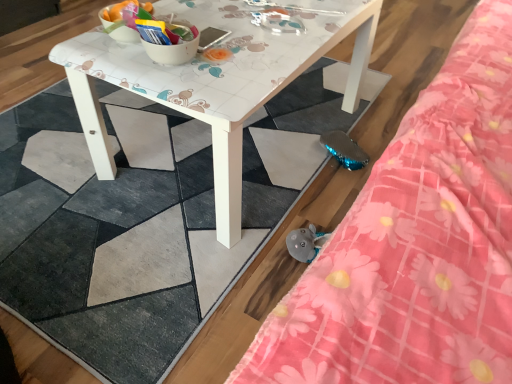
Question: From a real-world perspective, does pink floral fabric at upper right sit lower than white glossy table at center?

Choices:
 (A) yes
 (B) no

Answer: (B)

Question: Is pink floral fabric at upper right positioned beyond the bounds of white glossy table at center?

Choices:
 (A) no
 (B) yes

Answer: (B)

Question: From the image's perspective, is pink floral fabric at upper right located above white glossy table at center?

Choices:
 (A) no
 (B) yes

Answer: (A)

Question: Is pink floral fabric at upper right positioned behind white glossy table at center?

Choices:
 (A) yes
 (B) no

Answer: (B)

Question: Does pink floral fabric at upper right have a smaller size compared to white glossy table at center?

Choices:
 (A) yes
 (B) no

Answer: (A)

Question: Considering the relative sizes of pink floral fabric at upper right and white glossy table at center in the image provided, is pink floral fabric at upper right taller than white glossy table at center?

Choices:
 (A) yes
 (B) no

Answer: (A)

Question: Is white glossy table at center positioned behind pink floral fabric at upper right?

Choices:
 (A) yes
 (B) no

Answer: (A)

Question: Is white glossy table at center to the left of pink floral fabric at upper right from the viewer's perspective?

Choices:
 (A) no
 (B) yes

Answer: (B)

Question: Does white glossy table at center have a greater height compared to pink floral fabric at upper right?

Choices:
 (A) yes
 (B) no

Answer: (B)

Question: From the image's perspective, is white glossy table at center over pink floral fabric at upper right?

Choices:
 (A) no
 (B) yes

Answer: (B)

Question: Is white glossy table at center turned away from pink floral fabric at upper right?

Choices:
 (A) yes
 (B) no

Answer: (B)

Question: Is white glossy table at center bigger than pink floral fabric at upper right?

Choices:
 (A) yes
 (B) no

Answer: (A)

Question: From a real-world perspective, is pink floral fabric at upper right above or below white glossy table at center?

Choices:
 (A) below
 (B) above

Answer: (B)